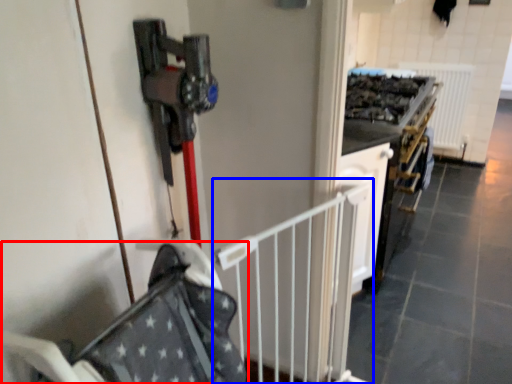
Question: Among these objects, which one is farthest to the camera, baby carriage (highlighted by a red box) or rail (highlighted by a blue box)?

Choices:
 (A) baby carriage
 (B) rail

Answer: (B)